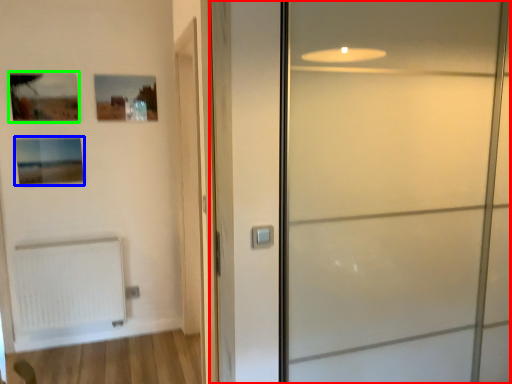
Question: Which is farther away from door (highlighted by a red box)? picture frame (highlighted by a blue box) or picture frame (highlighted by a green box)?

Choices:
 (A) picture frame
 (B) picture frame

Answer: (B)